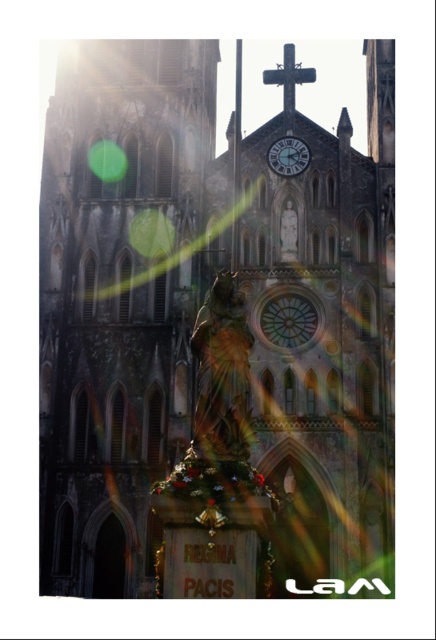
Which of these two, stone church at center or dark gray metallic cross at upper center, stands taller?

Standing taller between the two is stone church at center.

Who is more distant from viewer, (x=184, y=51) or (x=297, y=65)?

The point (x=184, y=51) is behind.

You are a GUI agent. You are given a task and a screenshot of the screen. Output one action in this format:
    pyautogui.click(x=<x>, y=<y>)
    Task: Click on the stone church at center
    
    Given the screenshot: What is the action you would take?
    pyautogui.click(x=210, y=326)

Which is above, gold polished statue at center or dark gray metallic cross at upper center?

Positioned higher is dark gray metallic cross at upper center.

Who is taller, gold polished statue at center or dark gray metallic cross at upper center?

dark gray metallic cross at upper center

Is point (239, 444) positioned before point (279, 83)?

Yes, it is.

Where is `gold polished statue at center`? The image size is (436, 640). gold polished statue at center is located at coordinates (222, 372).

Who is more distant from viewer, (365, 509) or (249, 417)?

Positioned behind is point (365, 509).

Can you confirm if stone church at center is bigger than gold polished statue at center?

Correct, stone church at center is larger in size than gold polished statue at center.

In order to click on stone church at center in this screenshot , I will do `click(210, 326)`.

In order to click on stone church at center in this screenshot , I will do `click(210, 326)`.